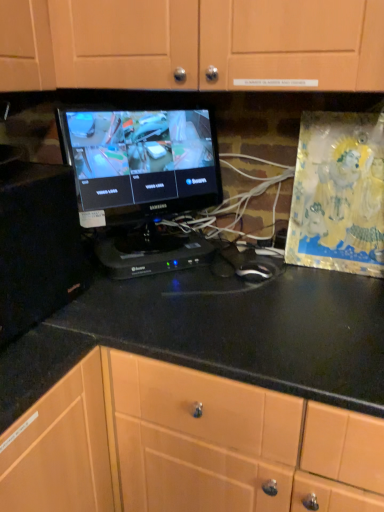
Question: Is the surface of black glossy countertop at center in direct contact with matte wood cabinet at upper center, marked as the first cabinetry in a top-to-bottom arrangement?

Choices:
 (A) yes
 (B) no

Answer: (B)

Question: Does black glossy countertop at center appear on the right side of matte wood cabinet at upper center, the 1th cabinetry from the right?

Choices:
 (A) yes
 (B) no

Answer: (A)

Question: Is black glossy countertop at center not inside matte wood cabinet at upper center, which is the 2th cabinetry from left to right?

Choices:
 (A) yes
 (B) no

Answer: (A)

Question: Considering the relative sizes of black glossy countertop at center and matte wood cabinet at upper center, which is the 2th cabinetry in bottom-to-top order, in the image provided, is black glossy countertop at center taller than matte wood cabinet at upper center, which is the 2th cabinetry in bottom-to-top order,?

Choices:
 (A) yes
 (B) no

Answer: (A)

Question: Does black glossy countertop at center have a greater width compared to matte wood cabinet at upper center, which is the 2th cabinetry in bottom-to-top order?

Choices:
 (A) yes
 (B) no

Answer: (A)

Question: Does black glossy countertop at center have a lesser height compared to matte wood cabinet at upper center, marked as the first cabinetry in a top-to-bottom arrangement?

Choices:
 (A) no
 (B) yes

Answer: (A)

Question: Is the position of black matte cabinet at left, which ranks as the first cabinetry in bottom-to-top order, more distant than that of matte wood cabinet at upper center, which is the 2th cabinetry in bottom-to-top order?

Choices:
 (A) yes
 (B) no

Answer: (B)

Question: Is black matte cabinet at left, which is counted as the second cabinetry, starting from the right, turned away from matte wood cabinet at upper center, marked as the first cabinetry in a top-to-bottom arrangement?

Choices:
 (A) no
 (B) yes

Answer: (A)

Question: Does black matte cabinet at left, which ranks as the 1th cabinetry in left-to-right order, have a larger size compared to matte wood cabinet at upper center, marked as the first cabinetry in a top-to-bottom arrangement?

Choices:
 (A) yes
 (B) no

Answer: (B)

Question: From a real-world perspective, is black matte cabinet at left, which is counted as the second cabinetry, starting from the right, located higher than matte wood cabinet at upper center, which is the 2th cabinetry in bottom-to-top order?

Choices:
 (A) yes
 (B) no

Answer: (B)

Question: Is black matte cabinet at left, which ranks as the first cabinetry in bottom-to-top order, not near matte wood cabinet at upper center, which is the 2th cabinetry from left to right?

Choices:
 (A) no
 (B) yes

Answer: (A)

Question: Is black matte cabinet at left, which ranks as the first cabinetry in bottom-to-top order, closer to camera compared to matte wood cabinet at upper center, which is the 2th cabinetry in bottom-to-top order?

Choices:
 (A) yes
 (B) no

Answer: (A)

Question: From a real-world perspective, is black matte cabinet at left, which ranks as the first cabinetry in bottom-to-top order, located higher than black glossy countertop at center?

Choices:
 (A) no
 (B) yes

Answer: (B)